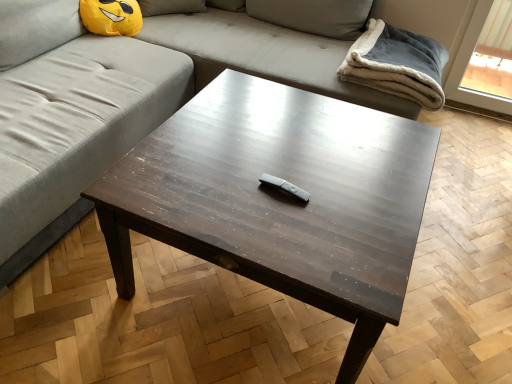
Locate an element on the screen. The width and height of the screenshot is (512, 384). vacant area that is situated to the right of gray matte wii remote at center is located at coordinates (338, 196).